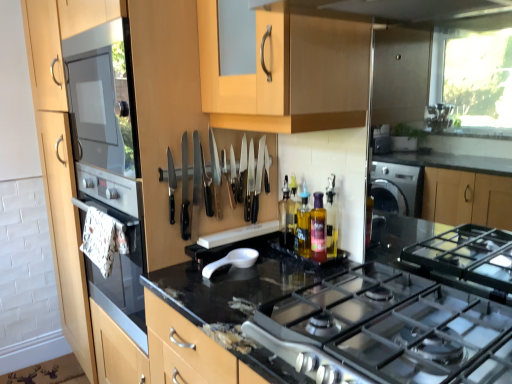
At what (x,y) coordinates should I click in order to perform the action: click on free space in front of white matte spoon at center. Please return your answer as a coordinate pair (x, y). Looking at the image, I should click on [x=231, y=289].